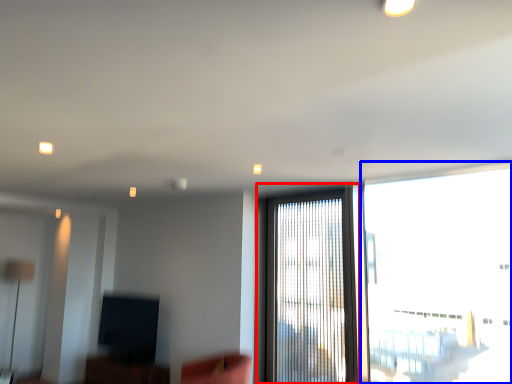
Question: Which point is closer to the camera, window (highlighted by a red box) or window (highlighted by a blue box)?

Choices:
 (A) window
 (B) window

Answer: (B)